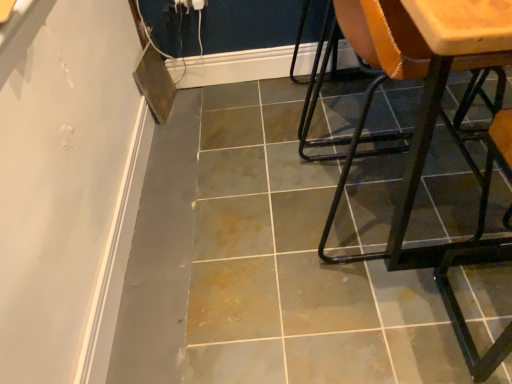
Image resolution: width=512 pixels, height=384 pixels. What are the coordinates of `blank space to the left of metallic orange chair at right, which ranks as the 2th chair in left-to-right order` in the screenshot? It's located at (396, 326).